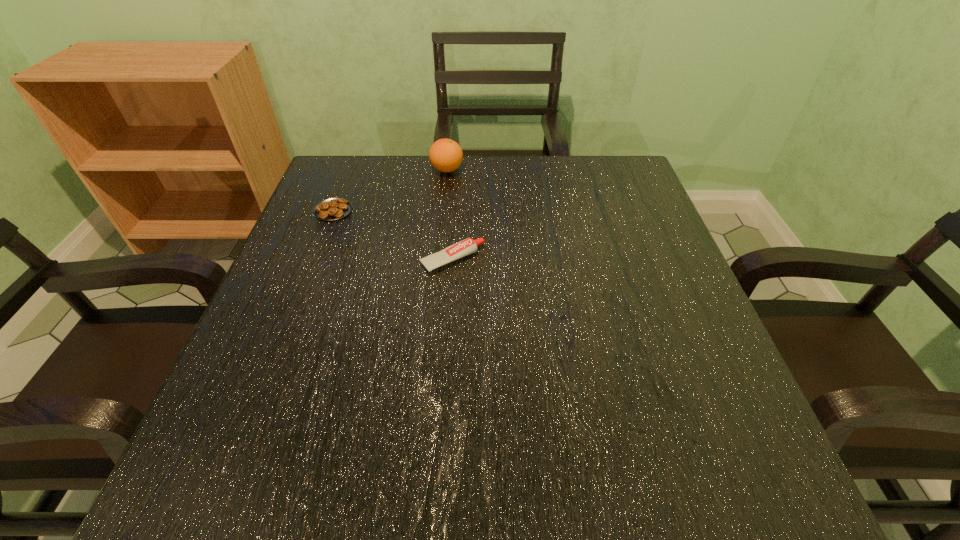
What are the coordinates of `pastry that is at the far edge` in the screenshot? It's located at (332, 209).

Image resolution: width=960 pixels, height=540 pixels. What are the coordinates of `object that is positioned at the left edge` in the screenshot? It's located at (332, 209).

In order to click on object that is at the far left corner in this screenshot , I will do `click(332, 209)`.

In the image, there is a desktop. Where is `free space at the far edge`? free space at the far edge is located at coordinates (557, 176).

The width and height of the screenshot is (960, 540). Find the location of `vacant region at the near edge of the desktop`. vacant region at the near edge of the desktop is located at coordinates (615, 484).

Image resolution: width=960 pixels, height=540 pixels. In the image, there is a desktop. What are the coordinates of `vacant space at the left edge` in the screenshot? It's located at pyautogui.click(x=300, y=322).

Where is `vacant space at the right edge of the desktop`? vacant space at the right edge of the desktop is located at coordinates (657, 431).

The height and width of the screenshot is (540, 960). In the image, there is a desktop. What are the coordinates of `vacant space at the far left corner` in the screenshot? It's located at (330, 171).

Identify the location of vacant space at the near left corner of the desktop. The height and width of the screenshot is (540, 960). (244, 496).

Identify the location of free point at the far right corner. (598, 190).